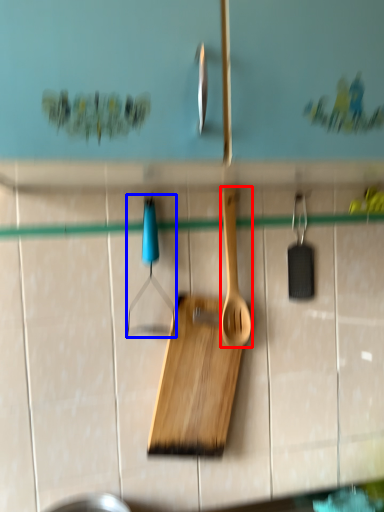
Question: Among these objects, which one is farthest to the camera, spatula (highlighted by a red box) or hanger (highlighted by a blue box)?

Choices:
 (A) spatula
 (B) hanger

Answer: (A)